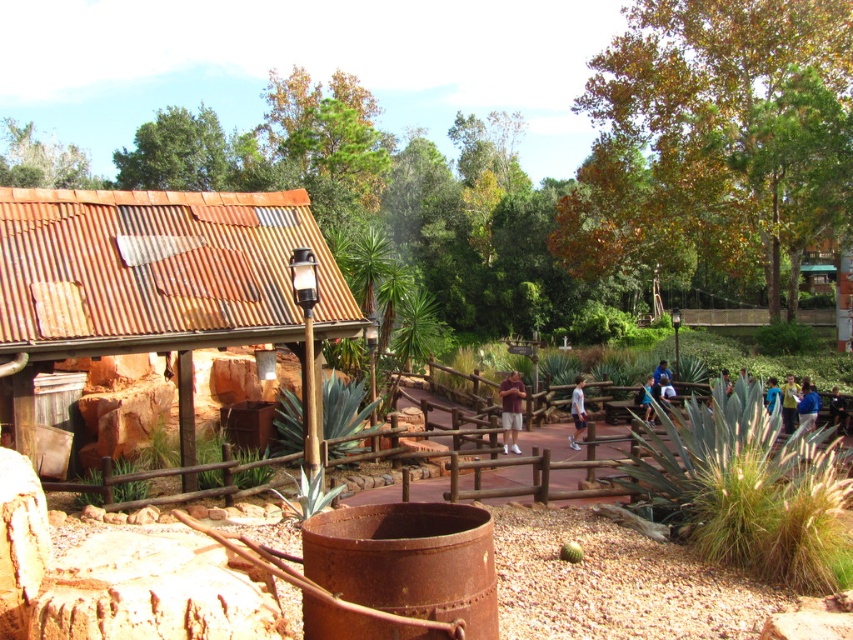
Question: Which point appears farthest from the camera in this image?

Choices:
 (A) (514, 380)
 (B) (788, 420)

Answer: (B)

Question: Which object is positioned farthest from the light blue shirt at center?

Choices:
 (A) white cotton shirt at center
 (B) yellow-green shirt at center-right
 (C) dark blue shirt at center

Answer: (C)

Question: Estimate the real-world distances between objects in this image. Which object is farther from the blue fabric shirt at lower right?

Choices:
 (A) white cotton shirt at center
 (B) rusty corrugated metal hut at left

Answer: (B)

Question: Does blue fabric shirt at lower right appear under blue fabric shirt at center?

Choices:
 (A) no
 (B) yes

Answer: (B)

Question: Does rusty corrugated metal hut at left have a larger size compared to dark blue shirt at center?

Choices:
 (A) yes
 (B) no

Answer: (B)

Question: Is white cotton shirt at center to the right of blue fabric shirt at lower right from the viewer's perspective?

Choices:
 (A) no
 (B) yes

Answer: (A)